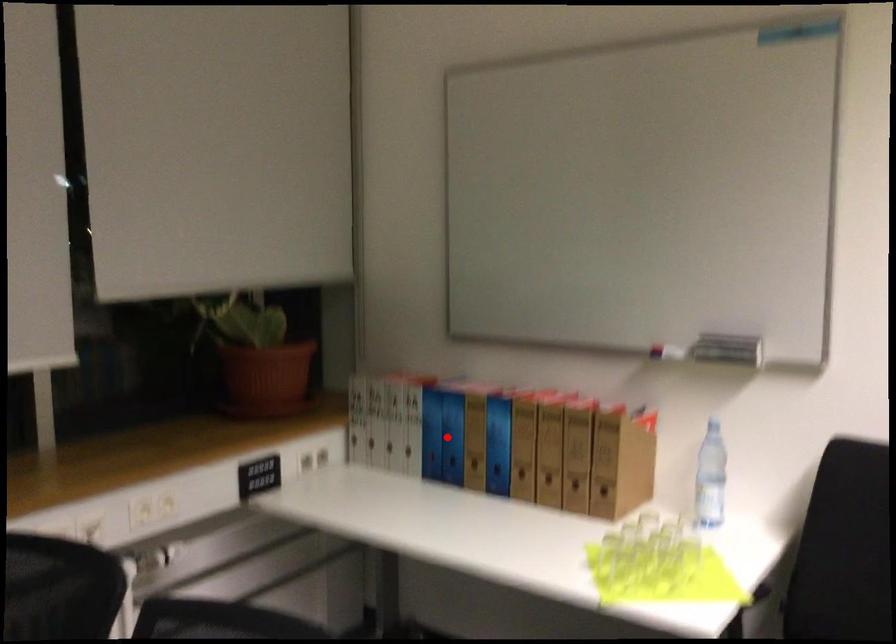
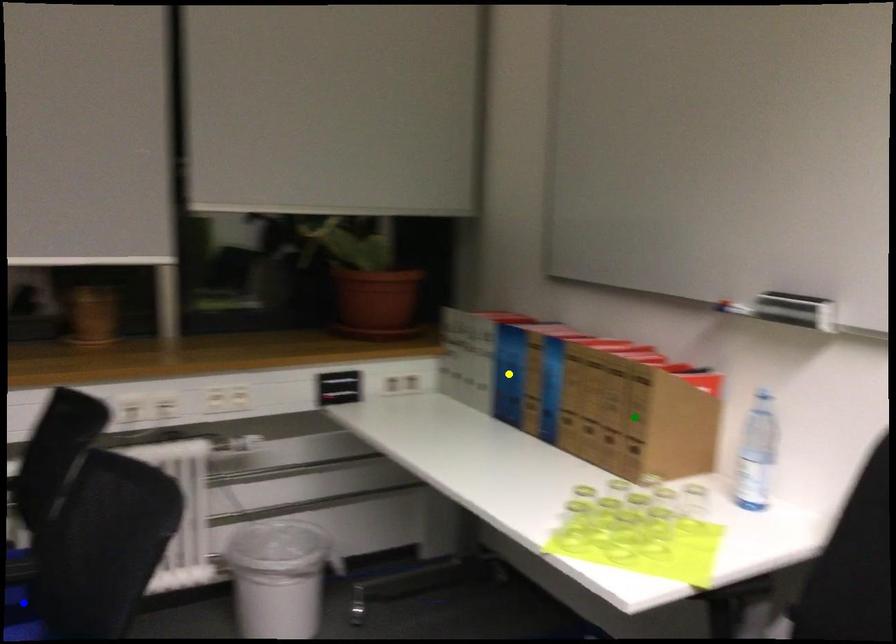
Question: I am providing you with two images of the same scene from different viewpoints. A red point is marked on the first image. You are given multiple points on the second image. Can you choose the point in image 2 that corresponds to the point in image 1?

Choices:
 (A) yellow point
 (B) blue point
 (C) green point

Answer: (A)